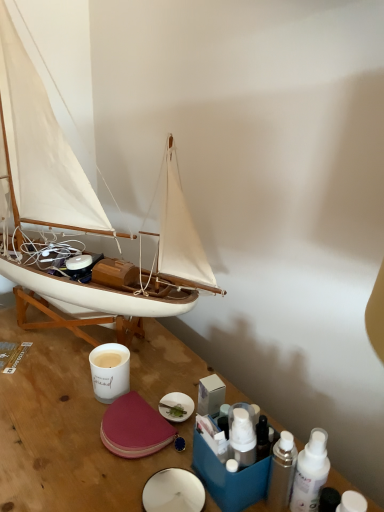
Question: Is white matte bottle at lower right, which appears as the 3th toiletry when viewed from the left, in front of white matte sailboat at left?

Choices:
 (A) no
 (B) yes

Answer: (A)

Question: Is white matte bottle at lower right, which appears as the 3th toiletry when viewed from the left, next to white matte sailboat at left and touching it?

Choices:
 (A) yes
 (B) no

Answer: (B)

Question: Would you say white matte sailboat at left is part of white matte bottle at lower right, which appears as the 3th toiletry when viewed from the left,'s contents?

Choices:
 (A) yes
 (B) no

Answer: (B)

Question: Is white matte bottle at lower right, which appears as the 3th toiletry when viewed from the left, outside of white matte sailboat at left?

Choices:
 (A) no
 (B) yes

Answer: (B)

Question: From the image's perspective, would you say white matte bottle at lower right, marked as the first toiletry in a right-to-left arrangement, is positioned over white matte sailboat at left?

Choices:
 (A) no
 (B) yes

Answer: (A)

Question: From a real-world perspective, is wooden table at center positioned above or below white matte bottle at lower right, marked as the first toiletry in a right-to-left arrangement?

Choices:
 (A) above
 (B) below

Answer: (B)

Question: In terms of width, does wooden table at center look wider or thinner when compared to white matte bottle at lower right, marked as the first toiletry in a right-to-left arrangement?

Choices:
 (A) thin
 (B) wide

Answer: (B)

Question: Looking at the image, does wooden table at center seem bigger or smaller compared to white matte bottle at lower right, which appears as the 3th toiletry when viewed from the left?

Choices:
 (A) small
 (B) big

Answer: (B)

Question: From their relative heights in the image, would you say wooden table at center is taller or shorter than white matte bottle at lower right, which appears as the 3th toiletry when viewed from the left?

Choices:
 (A) tall
 (B) short

Answer: (A)

Question: From a real-world perspective, relative to white matte cup at center, is wooden table at center vertically above or below?

Choices:
 (A) below
 (B) above

Answer: (A)

Question: From the image's perspective, is wooden table at center above or below white matte cup at center?

Choices:
 (A) below
 (B) above

Answer: (A)

Question: Considering the positions of wooden table at center and white matte cup at center in the image, is wooden table at center bigger or smaller than white matte cup at center?

Choices:
 (A) small
 (B) big

Answer: (B)

Question: Considering the positions of point (152, 455) and point (91, 356), is point (152, 455) closer or farther from the camera than point (91, 356)?

Choices:
 (A) farther
 (B) closer

Answer: (B)

Question: Is white matte bottle at lower right, which appears as the 3th toiletry when viewed from the left, to the left or to the right of white matte cup at center in the image?

Choices:
 (A) right
 (B) left

Answer: (A)

Question: From the image's perspective, is white matte bottle at lower right, which appears as the 3th toiletry when viewed from the left, above or below white matte cup at center?

Choices:
 (A) below
 (B) above

Answer: (A)